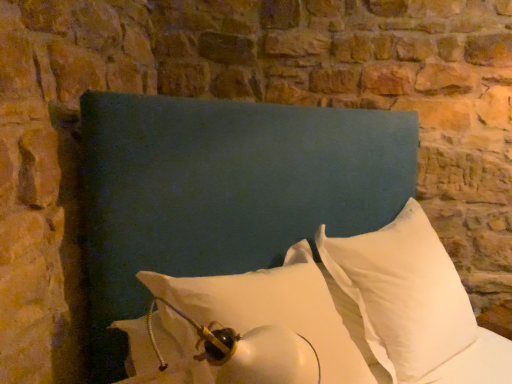
Question: Relative to white matte pillow at center, placed as the second pillow when sorted from right to left, is teal fabric headboard at center in front or behind?

Choices:
 (A) front
 (B) behind

Answer: (A)

Question: Would you say teal fabric headboard at center is inside or outside white matte pillow at center, placed as the second pillow when sorted from right to left?

Choices:
 (A) outside
 (B) inside

Answer: (A)

Question: Which of these objects is positioned closest to the teal fabric headboard at center?

Choices:
 (A) white matte pillow at center, placed as the second pillow when sorted from right to left
 (B) white soft pillow at center, which appears as the 2th pillow when viewed from the left

Answer: (A)

Question: Based on their relative distances, which object is nearer to the white matte pillow at center, placed as the second pillow when sorted from right to left?

Choices:
 (A) white soft pillow at center, which appears as the 2th pillow when viewed from the left
 (B) teal fabric headboard at center

Answer: (A)